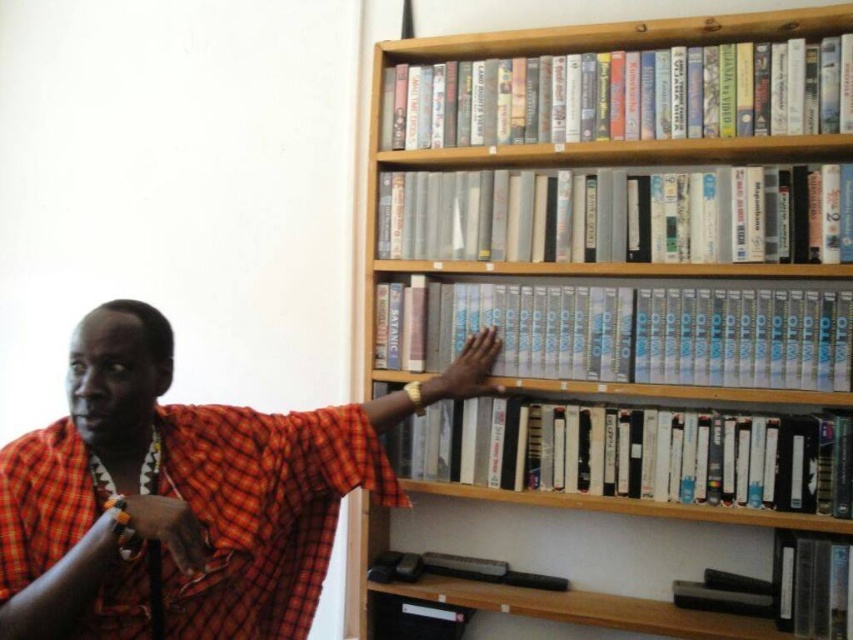
You are a librarian trying to locate a specific book on the shelf. The book you need is white and glossy. Where exactly is the white glossy book at upper center located on the shelf?

The white glossy book at upper center is located at point 0.150 in the x coordinate and 0.729 in the y coordinate.

You are a librarian who wants to place a new book on the shelf. The new book is the same size as the smooth orange cloth at lower left. Can you fit it next to the white glossy book at upper center without removing any existing items?

The white glossy book at upper center is larger than the smooth orange cloth at lower left. Since the new book is the same size as the smooth orange cloth at lower left, it may not fit next to the white glossy book at upper center due to the size difference.